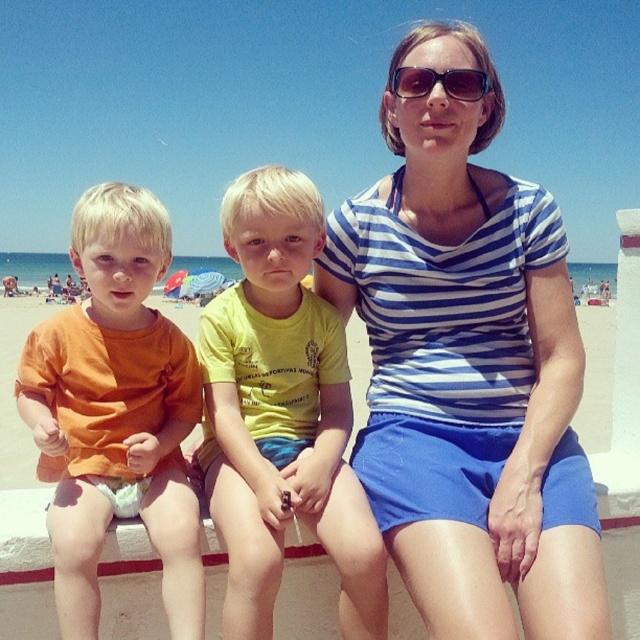
You are a photographer trying to capture a candid shot of the blue striped shirt at center and the sunglasses at center. Which object should you focus on first if you want to capture both in the same frame without moving the camera?

The blue striped shirt at center is below sunglasses at center, so you should focus on the sunglasses at center first to ensure both are in the frame without moving the camera.

Based on the photo, you are a photographer trying to capture a group photo of the blue striped shirt at center and the yellow matte shirt at center. Since you want to ensure both are in the frame, which direction should you position yourself relative to the subjects?

You should position yourself to the left of the blue striped shirt at center and yellow matte shirt at center because the blue striped shirt at center is on the right side of the yellow matte shirt at center, so facing them from the left would ensure both are captured in the frame.